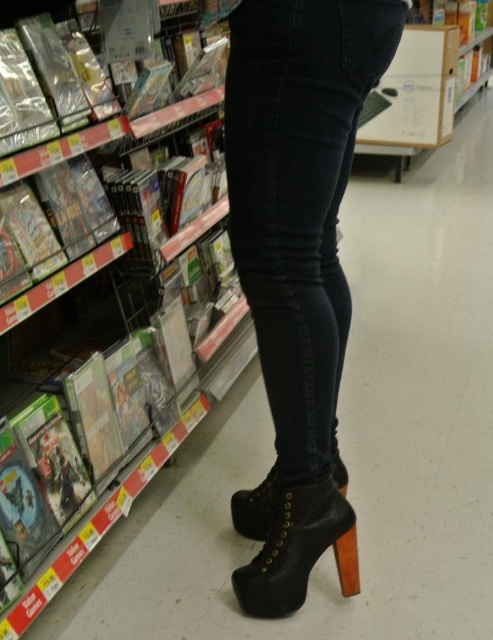
Question: Which point is farther to the camera?

Choices:
 (A) black leather boot at lower center
 (B) dark blue denim jeans at center

Answer: (A)

Question: Considering the real-world distances, which object is closest to the black leather boot at center?

Choices:
 (A) dark blue denim jeans at center
 (B) black leather boot at lower center

Answer: (B)

Question: Which of the following is the farthest from the observer?

Choices:
 (A) dark blue denim jeans at center
 (B) black leather boot at center

Answer: (B)

Question: Can you confirm if dark blue denim jeans at center is positioned below black leather boot at lower center?

Choices:
 (A) no
 (B) yes

Answer: (A)

Question: From the image, what is the correct spatial relationship of dark blue denim jeans at center in relation to black leather boot at lower center?

Choices:
 (A) below
 (B) above

Answer: (B)

Question: In this image, where is black leather boot at lower center located relative to black leather boot at center?

Choices:
 (A) right
 (B) left

Answer: (A)